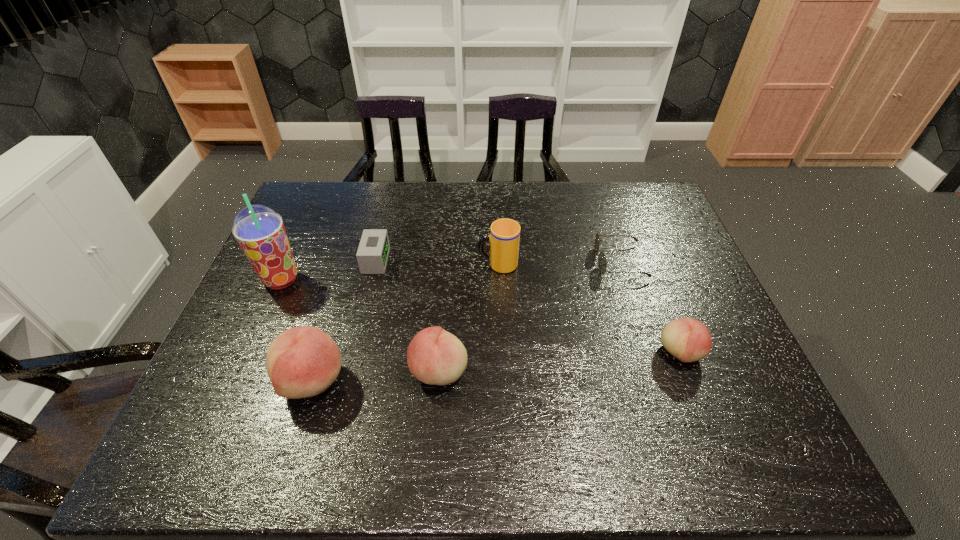
Locate an element on the screen. The height and width of the screenshot is (540, 960). the tallest peach is located at coordinates (301, 362).

The image size is (960, 540). Find the location of `the fourth object from left to right`. the fourth object from left to right is located at coordinates 436,357.

I want to click on the second shortest peach, so click(436, 357).

This screenshot has width=960, height=540. I want to click on the rightmost peach, so click(688, 340).

Find the location of a particular element. the fifth tallest object is located at coordinates (688, 340).

What are the coordinates of `alarm clock` in the screenshot? It's located at (372, 255).

Image resolution: width=960 pixels, height=540 pixels. I want to click on cup, so click(504, 238).

The width and height of the screenshot is (960, 540). I want to click on sunglasses, so click(602, 264).

Image resolution: width=960 pixels, height=540 pixels. I want to click on smoothie, so click(259, 230).

Locate an element on the screen. This screenshot has height=540, width=960. the leftmost object is located at coordinates [259, 230].